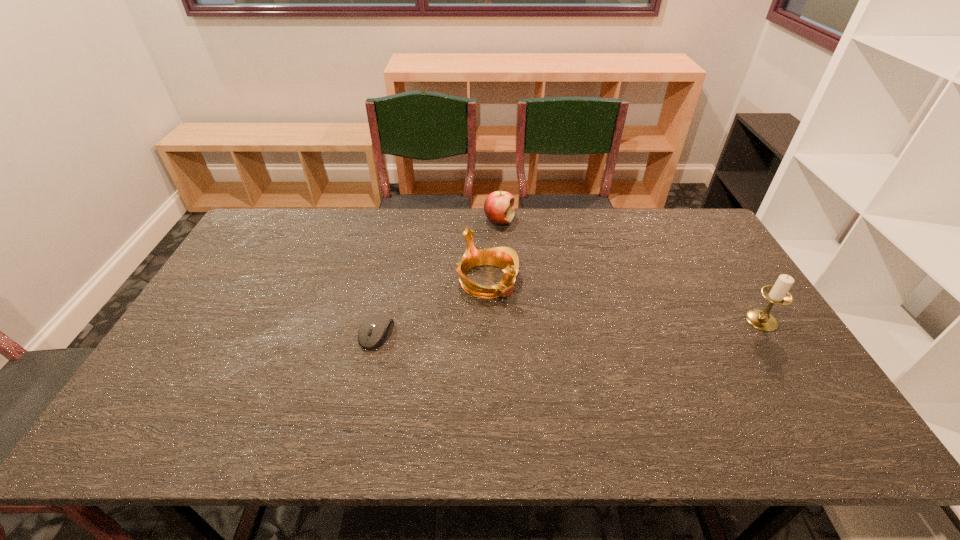
Locate an element on the screen. The height and width of the screenshot is (540, 960). blank space located on the bitten side of the apple is located at coordinates (552, 297).

Where is `free location located 0.370m at the front emblem of the third nearest object`? The image size is (960, 540). free location located 0.370m at the front emblem of the third nearest object is located at coordinates (598, 390).

This screenshot has height=540, width=960. I want to click on vacant space located 0.230m at the front emblem of the third nearest object, so click(x=559, y=353).

Find the location of a particular element. Image resolution: width=960 pixels, height=540 pixels. free region located at the front emblem of the third nearest object is located at coordinates (537, 331).

I want to click on object at the far edge, so click(x=499, y=206).

Locate an element on the screen. This screenshot has height=540, width=960. object that is at the right edge is located at coordinates (779, 294).

This screenshot has height=540, width=960. Identify the location of free space at the far edge of the desktop. (315, 238).

The image size is (960, 540). In the image, there is a desktop. Identify the location of vacant space at the near edge. (460, 406).

In the image, there is a desktop. Where is `vacant area at the left edge`? vacant area at the left edge is located at coordinates (212, 295).

Where is `vacant space at the right edge of the desktop`? Image resolution: width=960 pixels, height=540 pixels. vacant space at the right edge of the desktop is located at coordinates (724, 336).